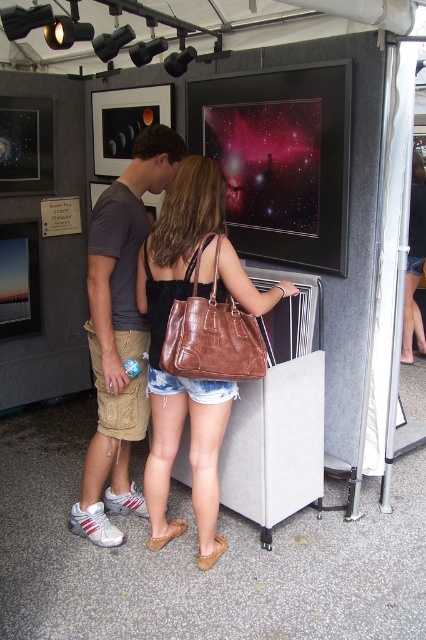
You are a photographer at the event and need to capture both the brown leather purse at center and the khaki cargo shorts at center in a single shot. Which object should you focus on first to ensure both are in frame?

You should focus on the khaki cargo shorts at center first because the brown leather purse at center is shorter in height, so adjusting the camera angle to include the taller khaki cargo shorts at center will naturally include the shorter brown leather purse at center as well.

You are a photographer at the event and want to capture a photo of the brown leather purse at center without including the two people. The camera frame is 0.5 units wide and 0.5 units tall. The point marking the purse is at (164, 339). Can you position the camera so that the purse is centered in the frame and the people are outside the frame?

The point marking the brown leather purse at center is at (164, 339). To center the purse in the camera frame of 0.5x0.5 units, the frame must be positioned such that its center aligns with the point. However, since the frame dimensions are equal to the coordinate system, the edges would extend 0.25 units from the center in all directions. The people are positioned around the purse, so it is unlikely they can be excluded without repositioning. Thus, the photographer cannot ensure the people are outside if